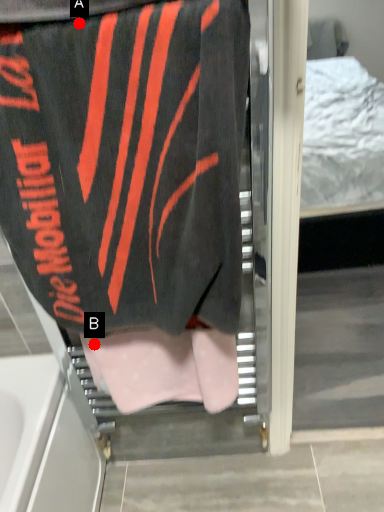
Question: Two points are circled on the image, labeled by A and B beside each circle. Which point is further to the camera?

Choices:
 (A) A is further
 (B) B is further

Answer: (B)